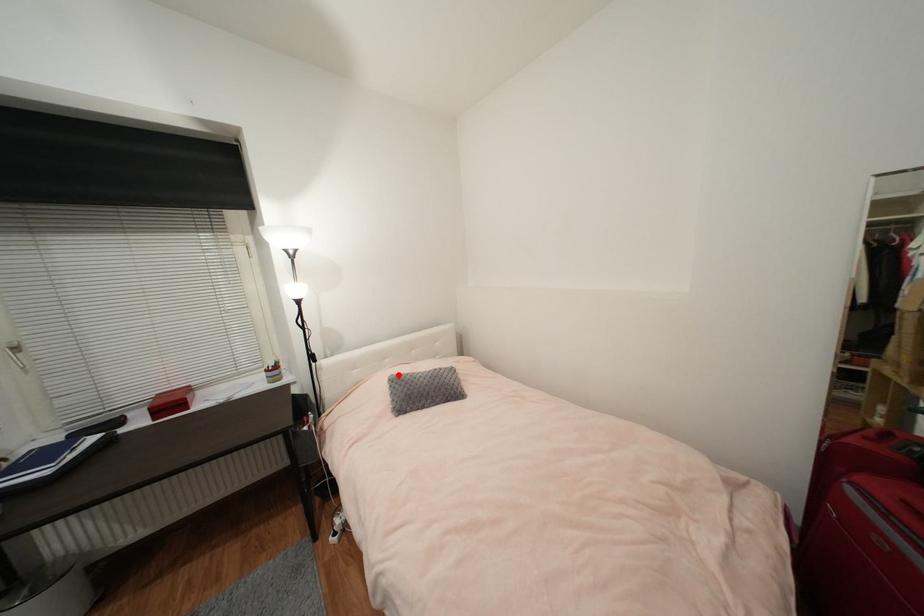
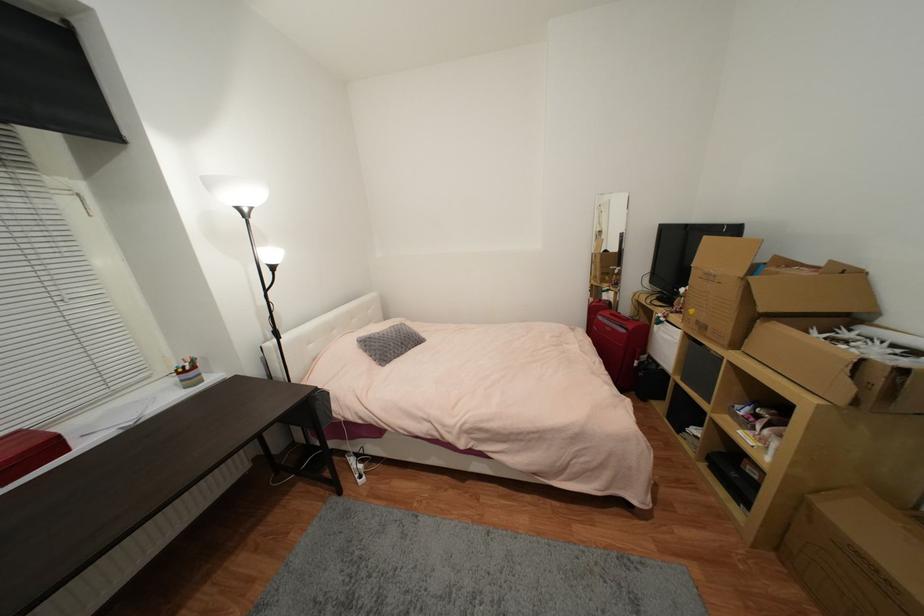
Question: I am providing you with two images of the same scene from different viewpoints. A red point is marked on the first image. Is the red point's position out of view in image 2?

Choices:
 (A) Yes
 (B) No

Answer: (B)